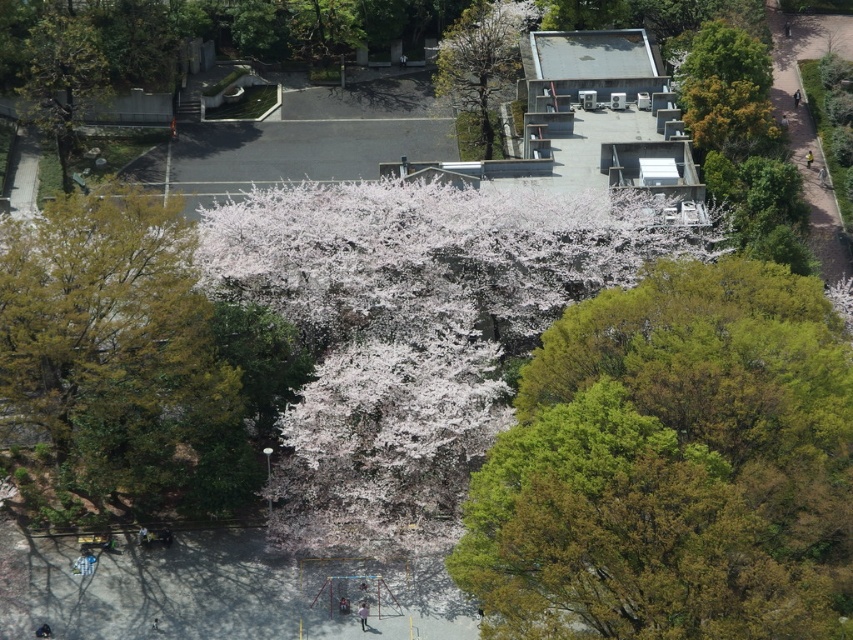
From the picture: How far apart are green leafy tree at lower left and smooth bark tree at upper center?

green leafy tree at lower left and smooth bark tree at upper center are 37.40 meters apart.

Based on the photo, does green leafy tree at lower left lie in front of smooth bark tree at upper center?

Yes, green leafy tree at lower left is closer to the viewer.

What do you see at coordinates (109, 340) in the screenshot? I see `green leafy tree at lower left` at bounding box center [109, 340].

Image resolution: width=853 pixels, height=640 pixels. What are the coordinates of `green leafy tree at lower left` in the screenshot? It's located at (109, 340).

Between white blossoms at center and green leafy tree at upper left, which one is positioned higher?

Positioned higher is green leafy tree at upper left.

Measure the distance from white blossoms at center to green leafy tree at upper left.

The distance of white blossoms at center from green leafy tree at upper left is 25.29 meters.

Is point (379, 364) in front of point (35, 100)?

Yes.

This screenshot has height=640, width=853. Find the location of `white blossoms at center`. white blossoms at center is located at coordinates (413, 332).

How much distance is there between white blossoms at center and smooth bark tree at upper center?

white blossoms at center and smooth bark tree at upper center are 23.80 meters apart.

Does white blossoms at center have a greater width compared to smooth bark tree at upper center?

Correct, the width of white blossoms at center exceeds that of smooth bark tree at upper center.

Does point (386, 305) come farther from viewer compared to point (492, 145)?

No.

Identify the location of white blossoms at center. This screenshot has height=640, width=853. (413, 332).